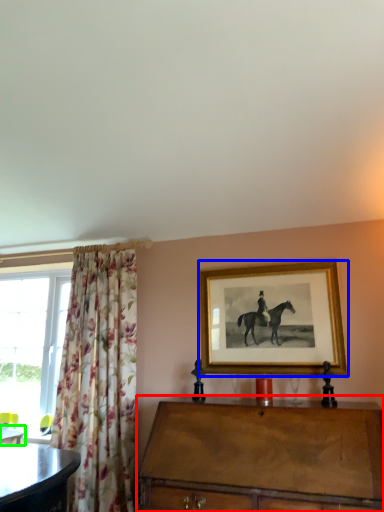
Question: Which is farther away from chest of drawers (highlighted by a red box)? picture frame (highlighted by a blue box) or desk (highlighted by a green box)?

Choices:
 (A) picture frame
 (B) desk

Answer: (B)